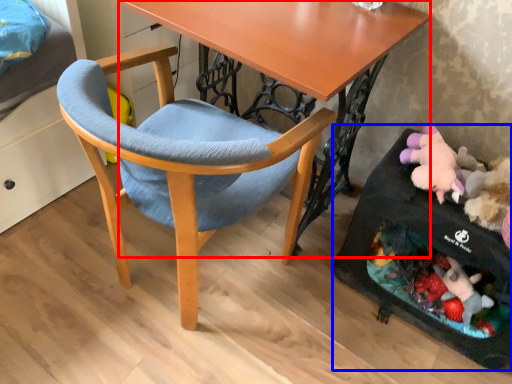
Question: Which object is further to the camera taking this photo, desk (highlighted by a red box) or baby carriage (highlighted by a blue box)?

Choices:
 (A) desk
 (B) baby carriage

Answer: (B)